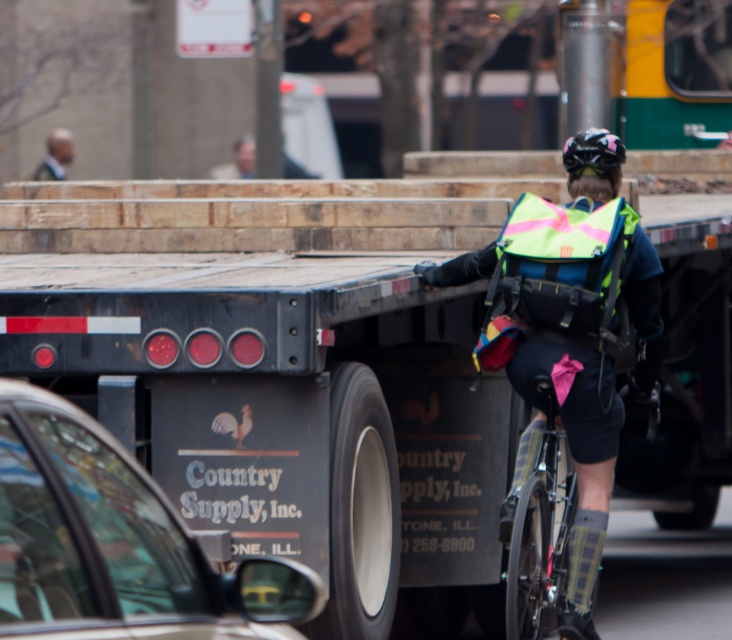
You are a pedestrian standing on the sidewalk and see the shiny black frame at center and the shiny black helmet at upper center in the scene. Which object is taller?

The shiny black frame at center is much taller than the shiny black helmet at upper center.

You are a delivery driver who needs to enter a low clearance tunnel. You are currently next to the black matte truck at lower left and the shiny black helmet at upper center. Which object will you need to be cautious about in terms of height when entering the tunnel?

The black matte truck at lower left is much taller than the shiny black helmet at upper center, so you should be cautious about the height of the black matte truck at lower left when entering the tunnel.

You are standing on the sidewalk and see the cyclist and the truck. If you want to reach the point marked at coordinates (403, 497), which object is closer to that point?

The point marked at coordinates (403, 497) is 10.24 meters away from the viewer, so it is closer to the cyclist than the truck since the truck is on the left side of the frame and the cyclist is on the right side.